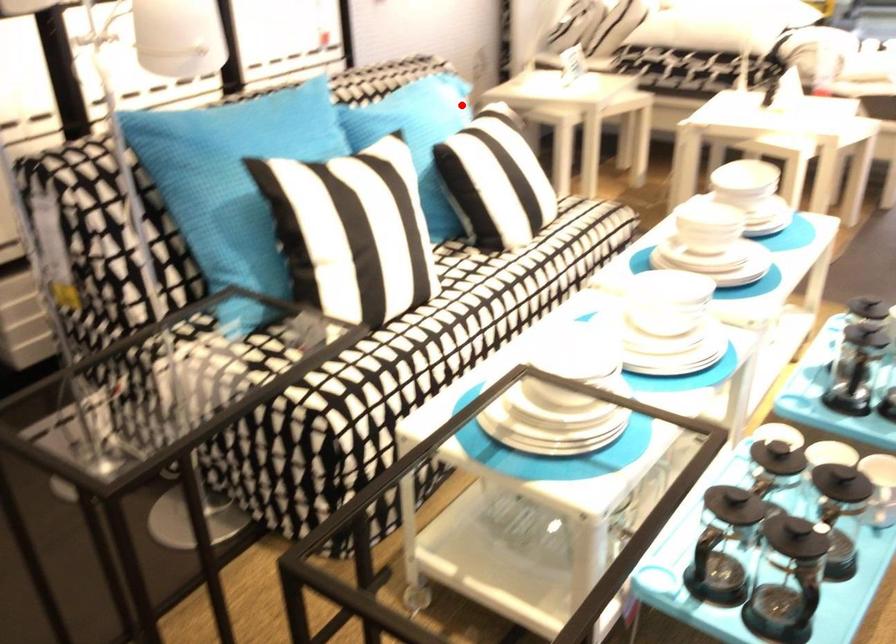
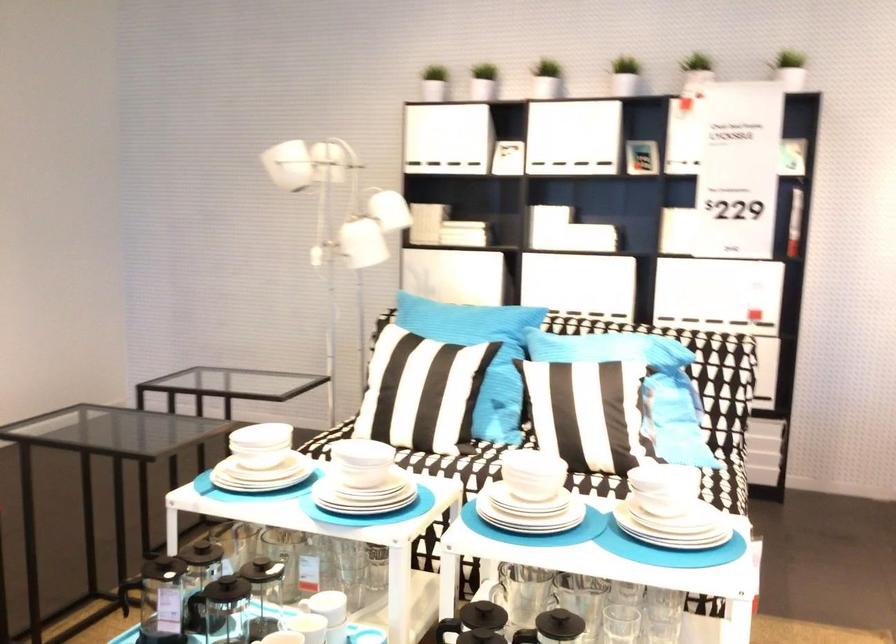
Question: A red point is marked in image1. In image2, is the corresponding 3D point closer to the camera or farther? Reply with the corresponding letter.

Choices:
 (A) The corresponding 3D point is closer.
 (B) The corresponding 3D point is farther.

Answer: (B)